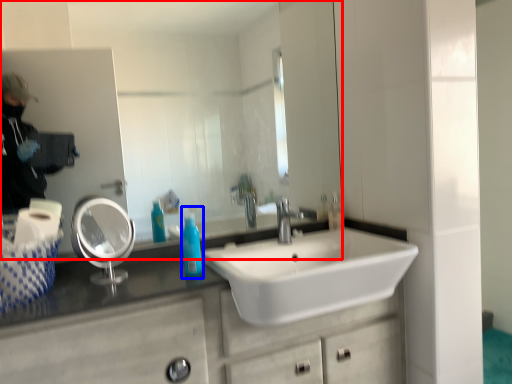
Question: Which object appears farthest to the camera in this image, mirror (highlighted by a red box) or cleaning product (highlighted by a blue box)?

Choices:
 (A) mirror
 (B) cleaning product

Answer: (A)